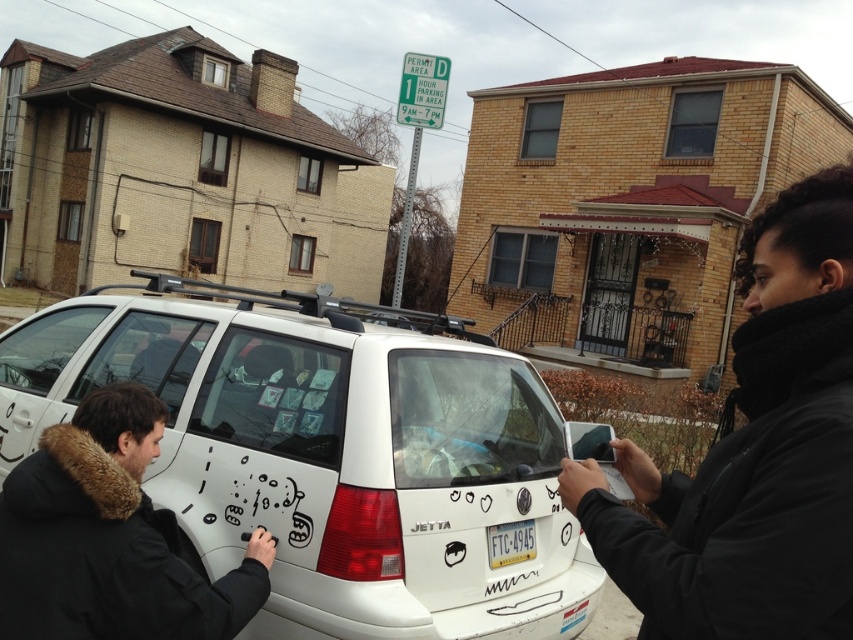
You are a delivery driver who needs to deliver a package to the house behind the white matte suv at center and the white plastic license plate at center. Which object should you move first to access the house?

The white matte suv at center should be moved first because it is closer to the viewer than the white plastic license plate at center, so it is blocking the path to the house.

You are a delivery robot with a box that is 5 feet long. You need to move between the black fur coat at lower left and the white plastic license plate at center. Will your box fit through the space between them?

The distance between the black fur coat at lower left and the white plastic license plate at center is 4.30 feet, which is shorter than the 5 feet length of the box. Therefore, the box will not fit through the space between them.